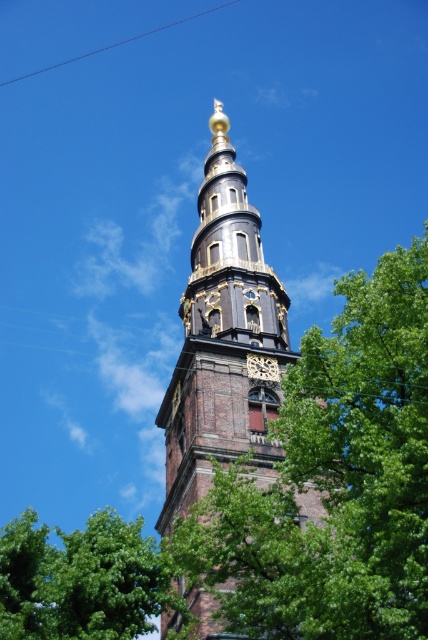
Is brown brick tower at center smaller than green leafy tree at lower left?

Indeed, brown brick tower at center has a smaller size compared to green leafy tree at lower left.

Is brown brick tower at center further to camera compared to green leafy tree at lower left?

That is True.

Is point (252, 417) farther from viewer compared to point (118, 618)?

Yes, it is behind point (118, 618).

This screenshot has width=428, height=640. Find the location of `brown brick tower at center`. brown brick tower at center is located at coordinates (223, 340).

Can you confirm if green leafy tree at lower left is taller than metallic wire at upper center?

Correct, green leafy tree at lower left is much taller as metallic wire at upper center.

Can you confirm if green leafy tree at lower left is positioned to the right of metallic wire at upper center?

Yes, green leafy tree at lower left is to the right of metallic wire at upper center.

Which is in front, point (88, 541) or point (145, 33)?

Positioned in front is point (88, 541).

Where is `green leafy tree at lower left`? green leafy tree at lower left is located at coordinates (80, 579).

Who is more forward, (247, 396) or (115, 44)?

Point (247, 396) is in front.

From the picture: Who is shorter, brown brick tower at center or metallic wire at upper center?

Standing shorter between the two is metallic wire at upper center.

You are a GUI agent. You are given a task and a screenshot of the screen. Output one action in this format:
    pyautogui.click(x=<x>, y=<y>)
    Task: Click on the brown brick tower at center
    
    Given the screenshot: What is the action you would take?
    pyautogui.click(x=223, y=340)

The width and height of the screenshot is (428, 640). What are the coordinates of `brown brick tower at center` in the screenshot? It's located at (223, 340).